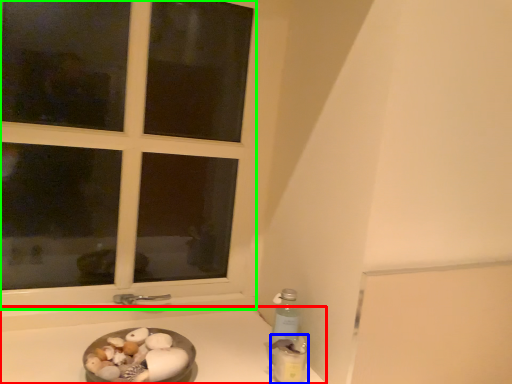
Question: Which is nearer to the counter top (highlighted by a red box)? bottle (highlighted by a blue box) or window (highlighted by a green box).

Choices:
 (A) bottle
 (B) window

Answer: (A)